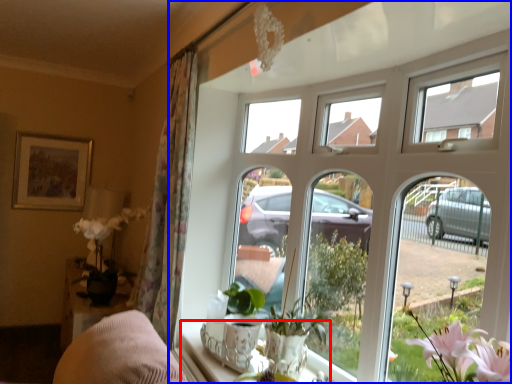
Question: Among these objects, which one is nearest to the camera, window sill (highlighted by a red box) or window (highlighted by a blue box)?

Choices:
 (A) window sill
 (B) window

Answer: (B)